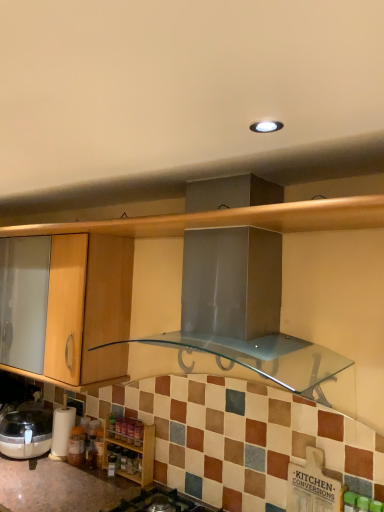
Identify the location of blank space situated above wooden spice rack at lower left (from a real-world perspective). (128, 422).